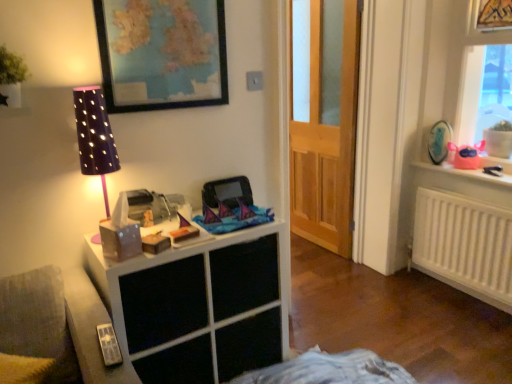
Image resolution: width=512 pixels, height=384 pixels. What are the coordinates of `empty space that is ontop of pink plastic bag at upper right (from a real-world perspective)` in the screenshot? It's located at (463, 165).